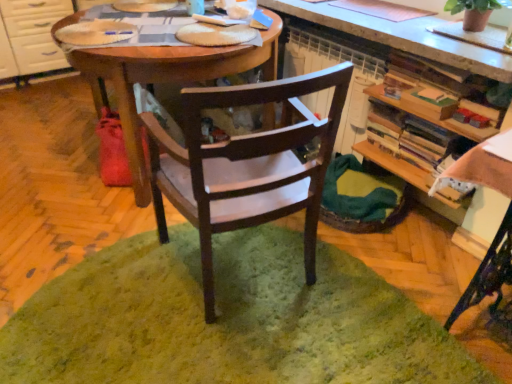
You are a GUI agent. You are given a task and a screenshot of the screen. Output one action in this format:
    pyautogui.click(x=<x>, y=<y>)
    Task: Click on the green fuzzy rug at center
    Image resolution: width=512 pixels, height=384 pixels.
    Given the screenshot: What is the action you would take?
    pyautogui.click(x=227, y=320)

At what (x,y) coordinates should I click in order to perform the action: click on green matte plant at upper right. Please return your answer as a coordinate pair (x, y). The width and height of the screenshot is (512, 384). Looking at the image, I should click on (473, 12).

This screenshot has height=384, width=512. In order to click on wooden desk at center in this screenshot , I will do `click(165, 80)`.

Which is in front, point (197, 124) or point (496, 4)?

The point (197, 124) is closer.

From a real-world perspective, who is located higher, mahogany wood chair at center or green matte plant at upper right?

green matte plant at upper right, from a real-world perspective.

You are a GUI agent. You are given a task and a screenshot of the screen. Output one action in this format:
    pyautogui.click(x=<x>, y=<y>)
    Task: Click on the chair directly beneath the green matte plant at upper right (from a real-world perspective)
    
    Given the screenshot: What is the action you would take?
    pyautogui.click(x=246, y=165)

Does mahogany wood chair at center come behind green matte plant at upper right?

No, mahogany wood chair at center is closer to the viewer.

Is mahogany wood chair at center inside or outside of white glossy cabinet at left?

mahogany wood chair at center is not enclosed by white glossy cabinet at left.

Considering the sizes of objects mahogany wood chair at center and white glossy cabinet at left in the image provided, who is taller, mahogany wood chair at center or white glossy cabinet at left?

mahogany wood chair at center is taller.

Which is more to the left, mahogany wood chair at center or white glossy cabinet at left?

From the viewer's perspective, white glossy cabinet at left appears more on the left side.

Is mahogany wood chair at center far away from white glossy cabinet at left?

mahogany wood chair at center is far away from white glossy cabinet at left.

Does white glossy cabinet at left lie behind green matte plant at upper right?

Yes.

Could green matte plant at upper right be considered to be inside white glossy cabinet at left?

No, green matte plant at upper right is not inside white glossy cabinet at left.

How distant is white glossy cabinet at left from green matte plant at upper right?

9.18 feet.

From the picture: From the image's perspective, is white glossy cabinet at left on green matte plant at upper right?

Yes.

Which is behind, point (415, 166) or point (6, 53)?

The point (6, 53) is more distant.

From a real-world perspective, does wooden bookshelf at right sit lower than white glossy cabinet at left?

No.

Are wooden bookshelf at right and white glossy cabinet at left far apart?

wooden bookshelf at right is far away from white glossy cabinet at left.

Find the location of a particular element. This screenshot has height=384, width=512. cabinetry below the wooden bookshelf at right (from a real-world perspective) is located at coordinates (31, 38).

Is wooden desk at center placed right next to white glossy cabinet at left?

They are not placed beside each other.

Which of these two, wooden desk at center or white glossy cabinet at left, is smaller?

With smaller size is white glossy cabinet at left.

Between wooden desk at center and white glossy cabinet at left, which one appears on the left side from the viewer's perspective?

Positioned to the left is white glossy cabinet at left.

From a real-world perspective, which is physically above, wooden desk at center or white glossy cabinet at left?

wooden desk at center is physically above.

From a real-world perspective, relative to mahogany wood chair at center, is white glossy cabinet at left vertically above or below?

white glossy cabinet at left is below mahogany wood chair at center.

Which is more to the right, white glossy cabinet at left or mahogany wood chair at center?

From the viewer's perspective, mahogany wood chair at center appears more on the right side.

Is white glossy cabinet at left in front of mahogany wood chair at center?

No, white glossy cabinet at left is further to the viewer.

How many degrees apart are the facing directions of white glossy cabinet at left and green fuzzy rug at center?

The facing directions of white glossy cabinet at left and green fuzzy rug at center are 178 degrees apart.

From a real-world perspective, is white glossy cabinet at left positioned above or below green fuzzy rug at center?

Clearly, from a real-world perspective, white glossy cabinet at left is above green fuzzy rug at center.

Can you see white glossy cabinet at left touching green fuzzy rug at center?

white glossy cabinet at left is not next to green fuzzy rug at center, and they're not touching.

Considering the points (36, 74) and (178, 345), which point is in front, point (36, 74) or point (178, 345)?

The point (178, 345) is closer to the camera.

Find the location of a particular element. houseplant located on the right of mahogany wood chair at center is located at coordinates (473, 12).

Find the location of a particular element. This screenshot has height=384, width=512. chair located below the white glossy cabinet at left (from the image's perspective) is located at coordinates (246, 165).

Estimate the real-world distances between objects in this image. Which object is closer to green fuzzy rug at center, wooden desk at center or mahogany wood chair at center?

mahogany wood chair at center lies closer to green fuzzy rug at center than the other object.

Estimate the real-world distances between objects in this image. Which object is closer to green matte plant at upper right, wooden desk at center or wooden bookshelf at right?

wooden bookshelf at right.

Based on their spatial positions, is green fuzzy rug at center or wooden bookshelf at right further from green matte plant at upper right?

green fuzzy rug at center.

From the image, which object appears to be nearer to white glossy cabinet at left, wooden bookshelf at right or green fuzzy rug at center?

Based on the image, green fuzzy rug at center appears to be nearer to white glossy cabinet at left.

When comparing their distances from wooden bookshelf at right, does wooden desk at center or green matte plant at upper right seem closer?

green matte plant at upper right.

Based on their spatial positions, is wooden bookshelf at right or white glossy cabinet at left further from mahogany wood chair at center?

white glossy cabinet at left is positioned further to the anchor mahogany wood chair at center.

From the image, which object appears to be farther from green fuzzy rug at center, wooden desk at center or wooden bookshelf at right?

Among the two, wooden bookshelf at right is located further to green fuzzy rug at center.

Based on the photo, when comparing their distances from green fuzzy rug at center, does wooden bookshelf at right or wooden desk at center seem closer?

Among the two, wooden desk at center is located nearer to green fuzzy rug at center.

The width and height of the screenshot is (512, 384). I want to click on shelf located between wooden desk at center and green matte plant at upper right in the left-right direction, so click(x=424, y=74).

At what (x,y) coordinates should I click in order to perform the action: click on chair situated between wooden desk at center and wooden bookshelf at right from left to right. Please return your answer as a coordinate pair (x, y). The height and width of the screenshot is (384, 512). Looking at the image, I should click on (246, 165).

This screenshot has height=384, width=512. Identify the location of chair between green fuzzy rug at center and white glossy cabinet at left from front to back. (246, 165).

Locate an element on the screen. chair between wooden desk at center and green matte plant at upper right from left to right is located at coordinates (246, 165).